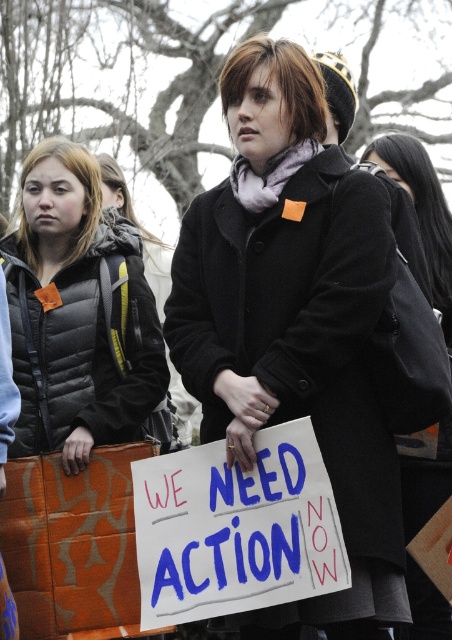
Does black puffer jacket at left have a greater width compared to black wool coat at center?

Yes, black puffer jacket at left is wider than black wool coat at center.

Which is behind, point (74, 307) or point (405, 148)?

The point (405, 148) is more distant.

Locate an element on the screen. black puffer jacket at left is located at coordinates (80, 316).

Is point (314, 232) positioned before point (146, 260)?

That is True.

Who is shorter, matte black coat at center or black quilted jacket at left?

With less height is matte black coat at center.

The image size is (452, 640). Identify the location of matte black coat at center. (295, 321).

Who is positioned more to the right, matte black coat at center or black wool coat at center?

From the viewer's perspective, black wool coat at center appears more on the right side.

What do you see at coordinates (295, 321) in the screenshot?
I see `matte black coat at center` at bounding box center [295, 321].

The height and width of the screenshot is (640, 452). I want to click on matte black coat at center, so click(295, 321).